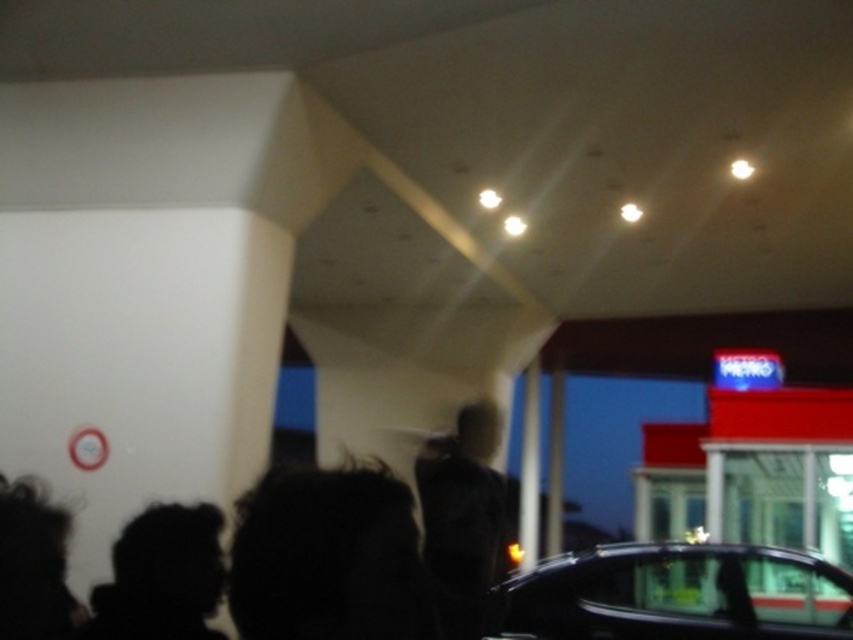
Question: Among these objects, which one is nearest to the camera?

Choices:
 (A) black silhouette at lower left
 (B) shiny black car at lower right

Answer: (A)

Question: Where is dark matte jacket at center located in relation to black silhouette at lower left in the image?

Choices:
 (A) left
 (B) right

Answer: (B)

Question: Considering the real-world distances, which object is closest to the black silhouette at lower left?

Choices:
 (A) dark matte jacket at center
 (B) shiny black car at lower right

Answer: (A)

Question: Does shiny black car at lower right have a lesser width compared to dark matte jacket at center?

Choices:
 (A) yes
 (B) no

Answer: (B)

Question: Which point is closer to the camera?

Choices:
 (A) shiny black car at lower right
 (B) dark matte jacket at center
 (C) black silhouette at lower left

Answer: (B)

Question: Is shiny black car at lower right to the right of dark matte jacket at center from the viewer's perspective?

Choices:
 (A) yes
 (B) no

Answer: (A)